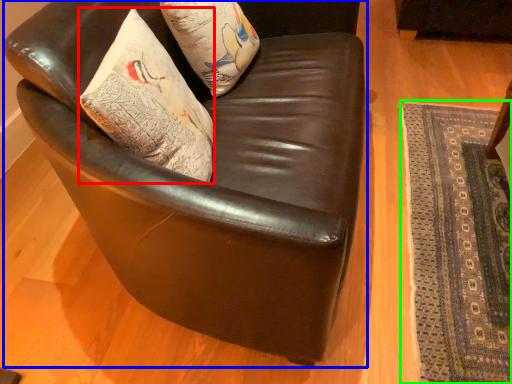
Question: Based on their relative distances, which object is nearer to throw pillow (highlighted by a red box)? Choose from chair (highlighted by a blue box) and mat (highlighted by a green box).

Choices:
 (A) chair
 (B) mat

Answer: (A)